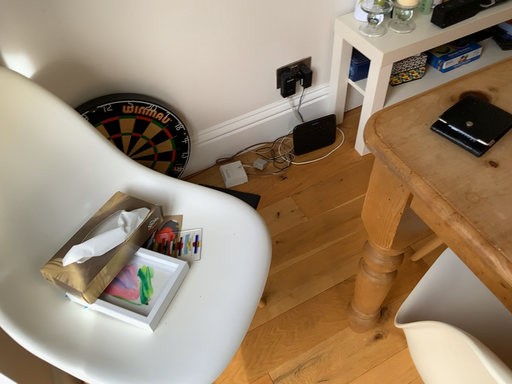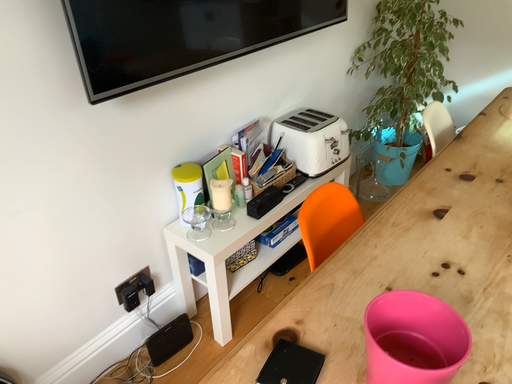
Question: Which way did the camera rotate in the video?

Choices:
 (A) rotated right
 (B) rotated left

Answer: (A)